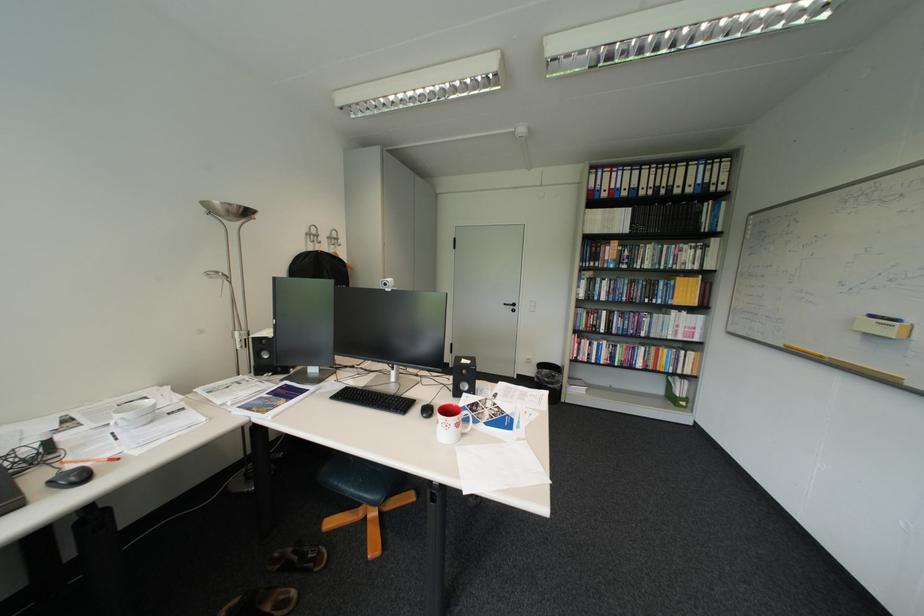
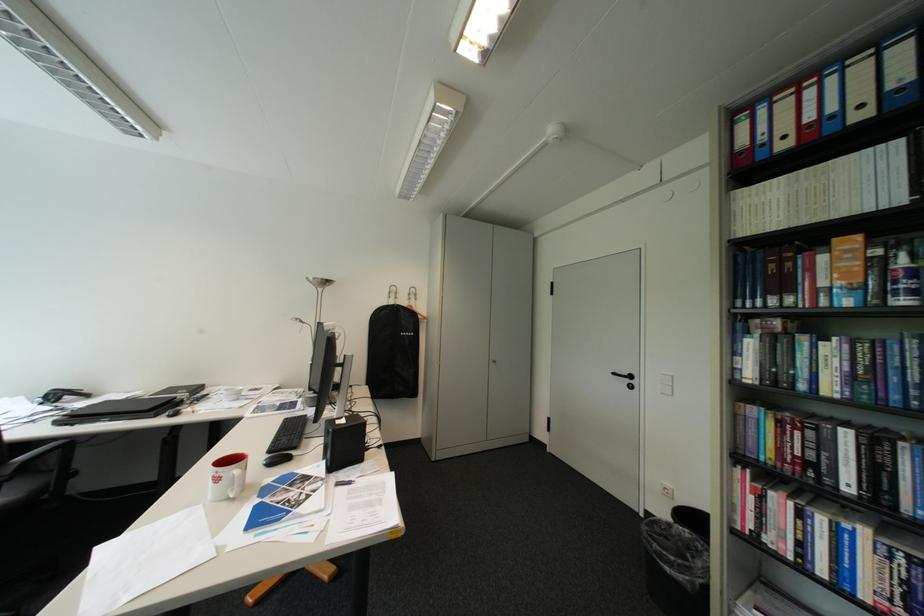
The point at [560,371] is marked in the first image. Where is the corresponding point in the second image?

(699, 531)